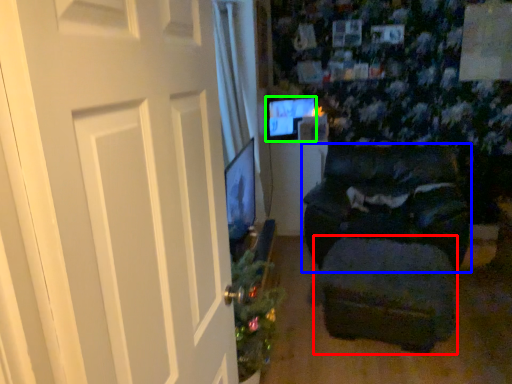
Question: Which is farther away from footrest (highlighted by a red box)? furniture (highlighted by a blue box) or computer monitor (highlighted by a green box)?

Choices:
 (A) furniture
 (B) computer monitor

Answer: (B)